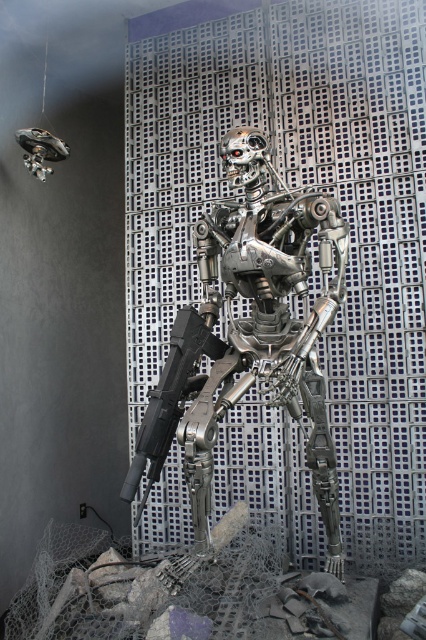
Can you confirm if metallic robot at center is positioned to the right of black matte gun at center?

Indeed, metallic robot at center is positioned on the right side of black matte gun at center.

Between metallic robot at center and black matte gun at center, which one is positioned higher?

metallic robot at center is above.

This screenshot has height=640, width=426. I want to click on metallic robot at center, so click(249, 333).